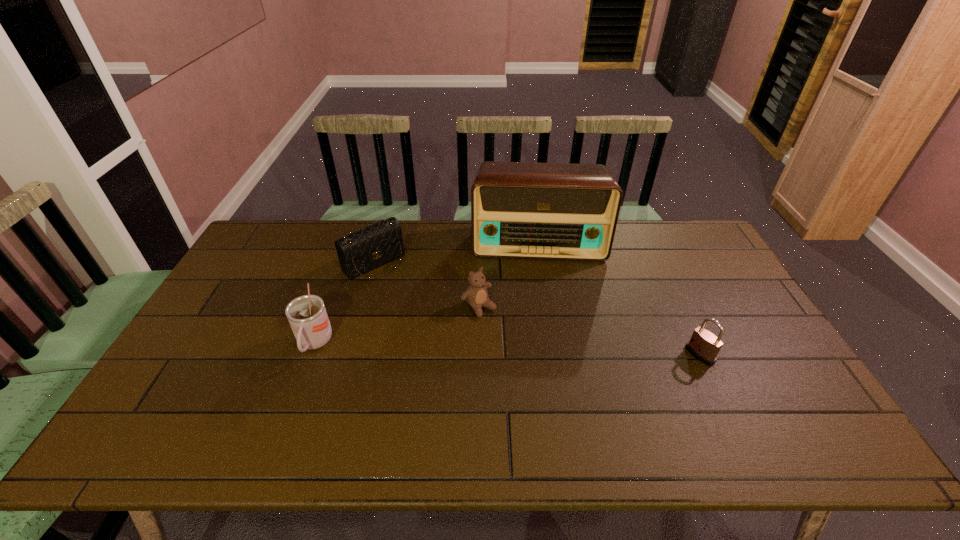
I want to click on vacant space situated 0.130m on the front flap of the clutch bag, so click(x=412, y=298).

The image size is (960, 540). In order to click on free space located 0.050m on the front flap of the clutch bag in this screenshot , I will do `click(398, 285)`.

I want to click on vacant position located on the front flap of the clutch bag, so click(x=412, y=298).

At what (x,y) coordinates should I click in order to perform the action: click on vacant space located on the front-facing side of the third nearest object. Please return your answer as a coordinate pair (x, y). Image resolution: width=960 pixels, height=540 pixels. Looking at the image, I should click on (508, 336).

Locate an element on the screen. This screenshot has height=540, width=960. free space located 0.340m on the front-facing side of the third nearest object is located at coordinates (570, 400).

Where is `blank space located on the front-facing side of the third nearest object`? The height and width of the screenshot is (540, 960). blank space located on the front-facing side of the third nearest object is located at coordinates (548, 377).

Identify the location of radio receiver that is at the far edge. (552, 211).

Identify the location of clutch bag located at the far edge. (362, 251).

Where is `vacant space at the far edge of the desktop`? Image resolution: width=960 pixels, height=540 pixels. vacant space at the far edge of the desktop is located at coordinates point(328,227).

Locate an element on the screen. The width and height of the screenshot is (960, 540). vacant space at the near edge is located at coordinates (453, 401).